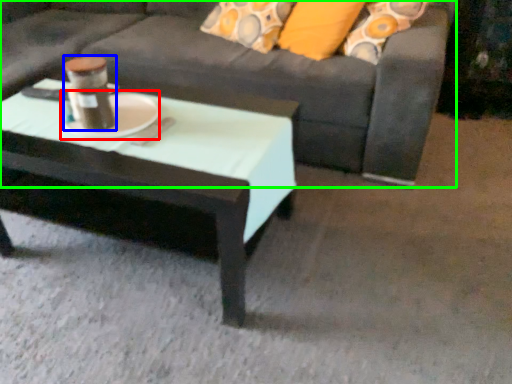
Question: Based on their relative distances, which object is nearer to platter (highlighted by a red box)? Choose from beverage (highlighted by a blue box) and studio couch (highlighted by a green box).

Choices:
 (A) beverage
 (B) studio couch

Answer: (A)